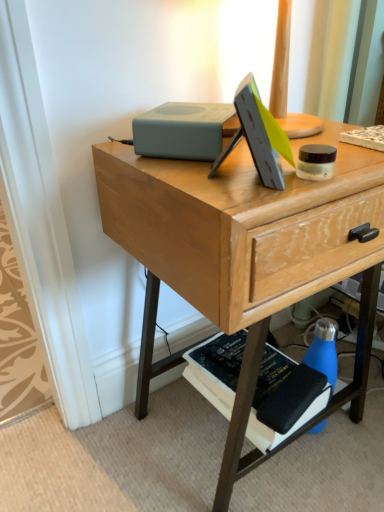
Identify the location of vacant region in front of blue matte water bottle at lower right. The image size is (384, 512). (338, 475).